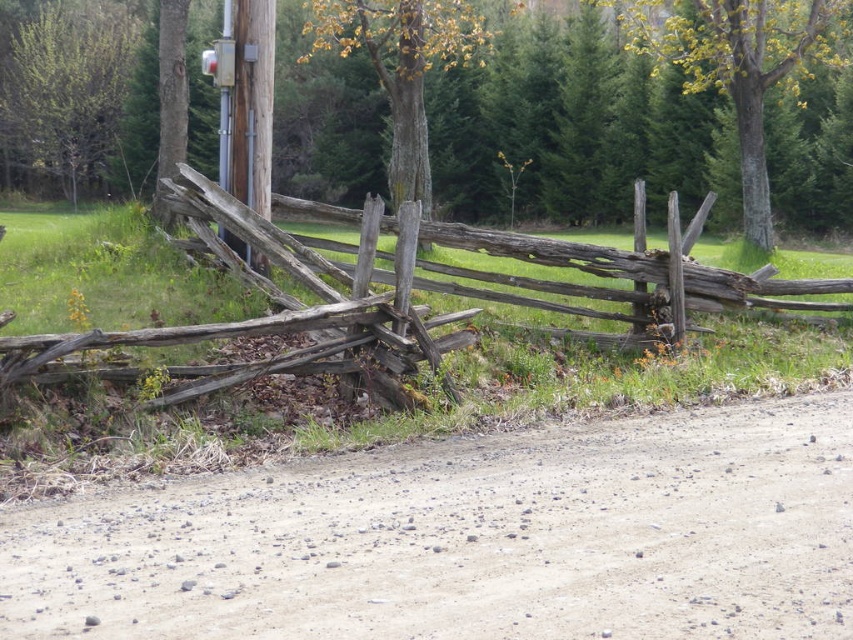
Who is taller, weathered wood fence at center or brown rough wood tree at center?

brown rough wood tree at center

Is point (407, 220) less distant than point (439, 0)?

Yes, it is.

Find the location of a particular element. The width and height of the screenshot is (853, 640). weathered wood fence at center is located at coordinates (405, 291).

Can you confirm if smooth brown tree trunk at upper center is shorter than smooth wooden post at center?

Incorrect, smooth brown tree trunk at upper center's height does not fall short of smooth wooden post at center's.

Can you confirm if smooth brown tree trunk at upper center is taller than smooth wooden post at center?

Indeed, smooth brown tree trunk at upper center has a greater height compared to smooth wooden post at center.

Which is behind, point (459, 88) or point (265, 177)?

Positioned behind is point (459, 88).

I want to click on smooth brown tree trunk at upper center, so click(x=573, y=131).

Can you confirm if smooth brown wood at upper right is positioned below metallic gray pole at upper center?

No.

Who is more distant from viewer, (653, 3) or (223, 128)?

Point (653, 3)

Is point (714, 13) closer to viewer compared to point (218, 176)?

Yes, it is.

This screenshot has height=640, width=853. Find the location of `smooth brown wood at upper right`. smooth brown wood at upper right is located at coordinates (738, 65).